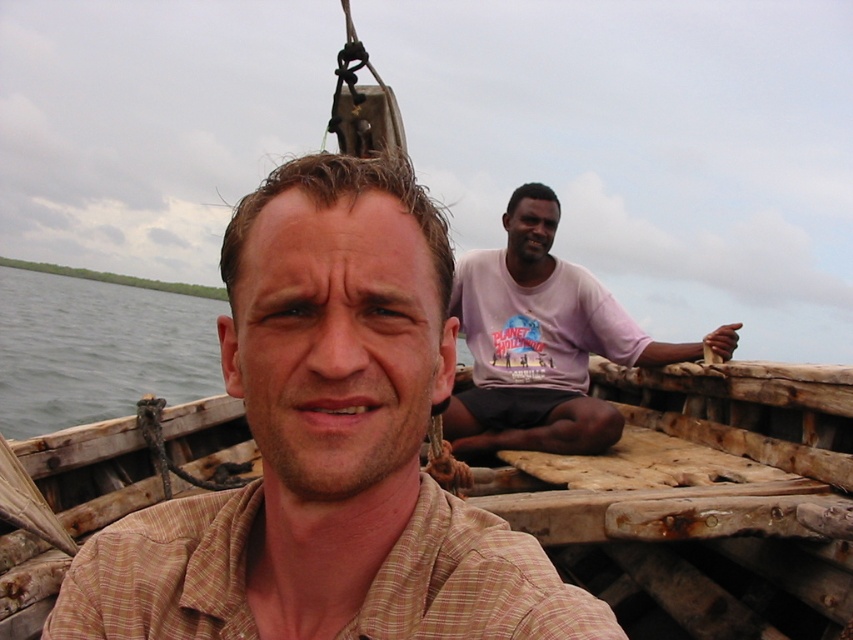
Question: Can you confirm if pink cotton shirt at upper right is positioned above green water at left?

Choices:
 (A) no
 (B) yes

Answer: (A)

Question: Among these objects, which one is nearest to the camera?

Choices:
 (A) weathered wood boat at center
 (B) green water at left
 (C) pink cotton shirt at upper right

Answer: (A)

Question: Can you confirm if light brown plaid shirt at center is positioned to the left of green water at left?

Choices:
 (A) no
 (B) yes

Answer: (A)

Question: Which of the following is the closest to the observer?

Choices:
 (A) click(x=619, y=332)
 (B) click(x=764, y=518)

Answer: (B)

Question: Which point is closer to the camera taking this photo?

Choices:
 (A) 126,305
 (B) 316,568
 (C) 579,376
 (D) 804,490

Answer: (B)

Question: Is the position of pink cotton shirt at upper right less distant than that of green water at left?

Choices:
 (A) no
 (B) yes

Answer: (B)